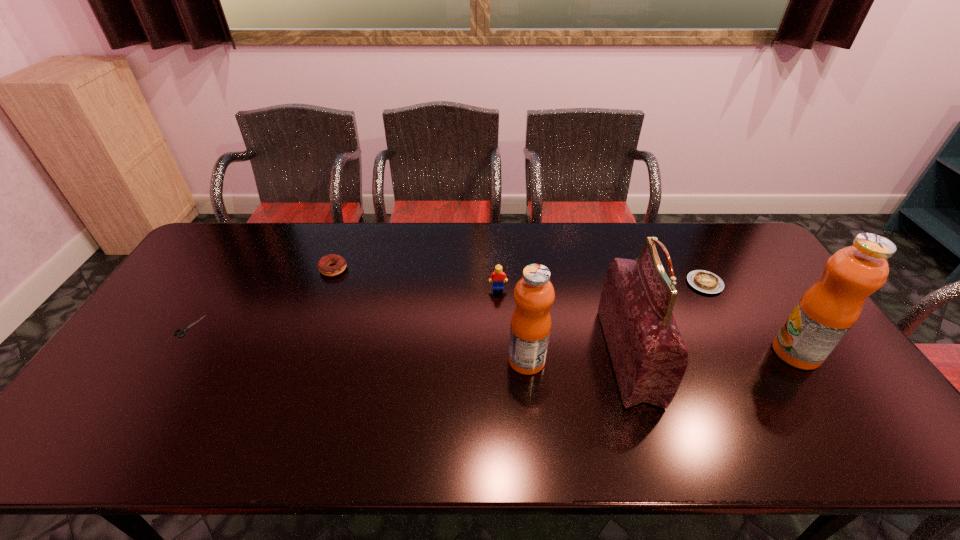
What are the coordinates of `the leftmost object` in the screenshot? It's located at (183, 330).

This screenshot has height=540, width=960. I want to click on the third object from right to left, so click(x=648, y=354).

Locate an element on the screen. This screenshot has width=960, height=540. free space located 0.150m on the right of the third tallest object is located at coordinates (602, 360).

You are a GUI agent. You are given a task and a screenshot of the screen. Output one action in this format:
    pyautogui.click(x=<x>, y=<y>)
    Task: Click on the free spot located on the back of the right fruit juice
    
    Given the screenshot: What is the action you would take?
    pyautogui.click(x=756, y=294)

This screenshot has width=960, height=540. Find the location of `vacant position located on the right of the fifth tallest object`. vacant position located on the right of the fifth tallest object is located at coordinates (450, 269).

Locate an element on the screen. vacant space located 0.280m on the face of the Lego is located at coordinates (501, 363).

Where is `free region located on the left of the second object from right to left`? Image resolution: width=960 pixels, height=540 pixels. free region located on the left of the second object from right to left is located at coordinates (587, 284).

What are the coordinates of `free point located 0.100m on the right of the shortest object` in the screenshot? It's located at (234, 326).

Image resolution: width=960 pixels, height=540 pixels. What are the coordinates of `free location located 0.070m on the front-facing side of the fifth object from left to right` in the screenshot? It's located at (583, 356).

At what (x,y) coordinates should I click in order to perform the action: click on vacant region located on the front-facing side of the fifth object from left to right. Please return your answer as a coordinate pair (x, y). Looking at the image, I should click on (549, 356).